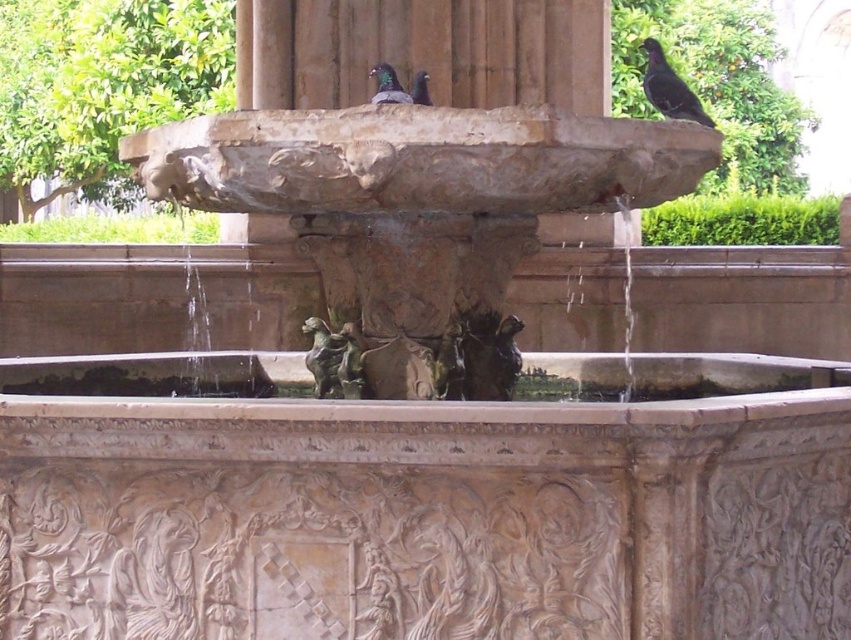
You are standing in front of the classical fountain and notice two pigeons perched on the upper center. Which pigeon is closer to you, the shiny dark gray pigeon at upper center or the matte black pigeon at upper center?

The shiny dark gray pigeon at upper center is closer to you because it is positioned under the matte black pigeon at upper center.